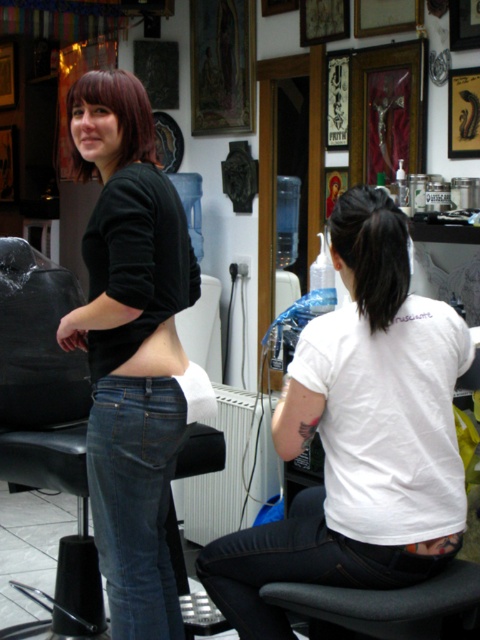
Question: Which of these objects is positioned closest to the dark brown hair at upper left?

Choices:
 (A) jeans at lower left
 (B) matte skin belly at center
 (C) denim jeans at center
 (D) matte black shirt at upper left

Answer: (D)

Question: Is matte black shirt at upper left to the left of black matte ponytail at center back from the viewer's perspective?

Choices:
 (A) yes
 (B) no

Answer: (A)

Question: Which of the following is the closest to the observer?

Choices:
 (A) (152, 388)
 (B) (108, 81)
 (C) (377, 317)
 (D) (155, 340)

Answer: (C)

Question: Does dark brown hair at upper left appear under matte skin belly at center?

Choices:
 (A) yes
 (B) no

Answer: (B)

Question: Is matte black shirt at upper left wider than matte skin belly at center?

Choices:
 (A) yes
 (B) no

Answer: (A)

Question: Which object is farther from the camera taking this photo?

Choices:
 (A) jeans at lower left
 (B) matte skin belly at center
 (C) white matte shirt at center
 (D) dark brown hair at upper left

Answer: (D)